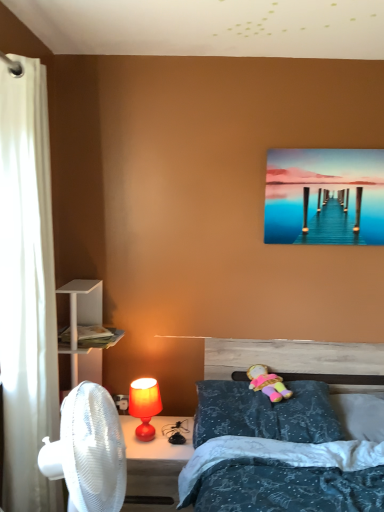
Question: Is blue textured pillow at center, which is the second pillow from right to left, bigger or smaller than metallic glossy pier at upper right?

Choices:
 (A) small
 (B) big

Answer: (B)

Question: From a real-world perspective, is blue textured pillow at center, which is the second pillow from right to left, physically located above or below metallic glossy pier at upper right?

Choices:
 (A) below
 (B) above

Answer: (A)

Question: Which is farther from the plush fabric doll at center?

Choices:
 (A) white fabric curtain at left
 (B) blue textured pillow at lower right, the first pillow in the right-to-left sequence
 (C) matte orange lamp at lower left
 (D) blue textured pillow at center, which is the second pillow from right to left
 (E) metallic glossy pier at upper right

Answer: (A)

Question: Which object is the closest to the blue textured pillow at center, which is the second pillow from right to left?

Choices:
 (A) metallic glossy pier at upper right
 (B) blue textured pillow at lower right, the first pillow in the right-to-left sequence
 (C) matte red lamp at lower center
 (D) matte orange lamp at lower left
 (E) white fabric curtain at left

Answer: (B)